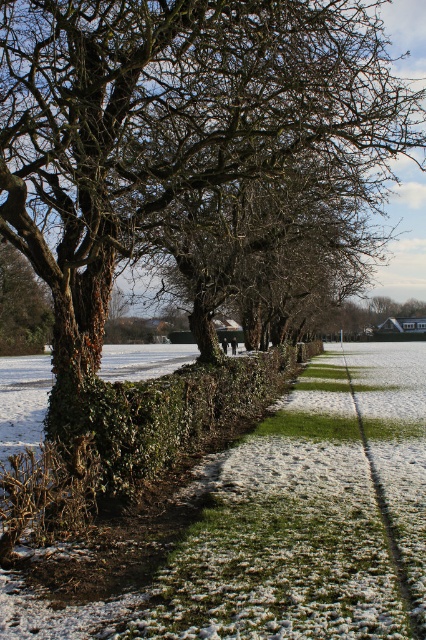
You are standing on the pathway and want to take a photo of both the green leafy hedge at center and the green leafy tree at upper left. Which one should you focus on first to ensure both are in clear view?

You should focus on the green leafy hedge at center first since it is closer to the viewer than the green leafy tree at upper left, ensuring both are in focus when using depth of field.